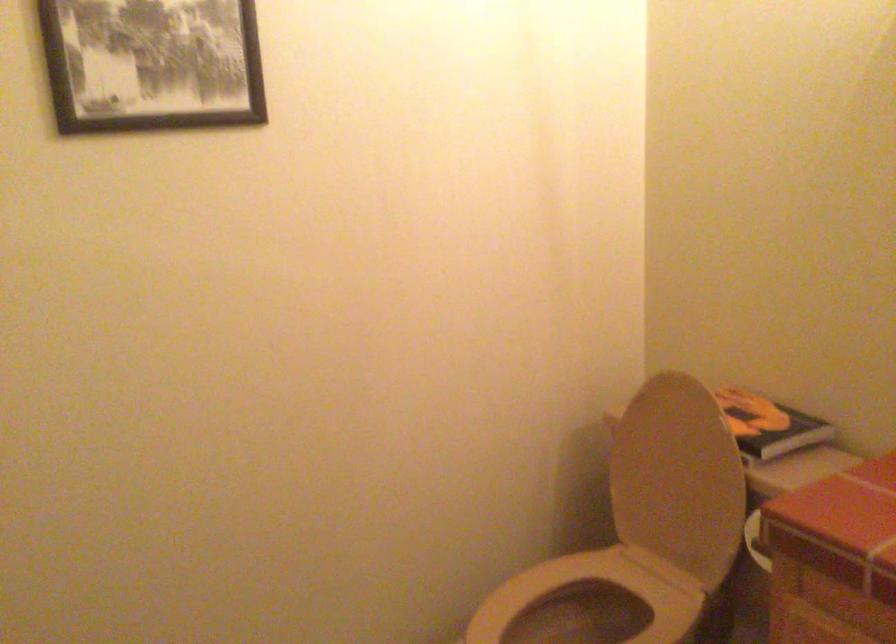
At what (x,y) coordinates should I click in order to perform the action: click on toilet seat lid. Please return your answer as a coordinate pair (x, y). This screenshot has height=644, width=896. Looking at the image, I should click on (599, 592).